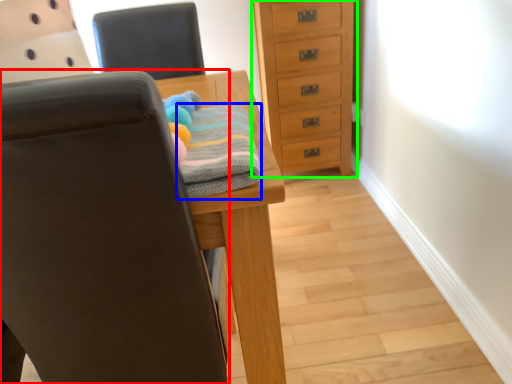
Question: Which object is positioned farthest from chair (highlighted by a red box)? Select from bath towel (highlighted by a blue box) and chest of drawers (highlighted by a green box).

Choices:
 (A) bath towel
 (B) chest of drawers

Answer: (B)